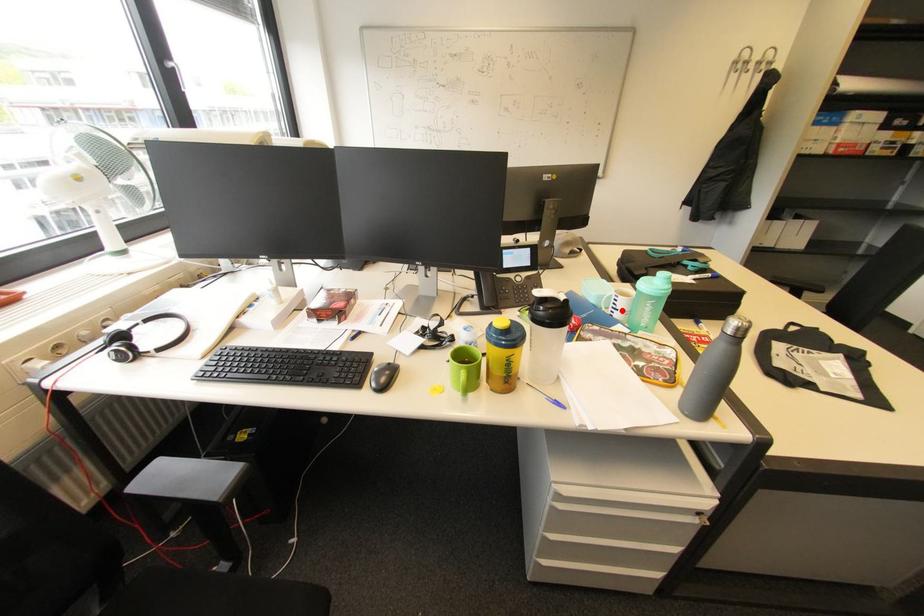
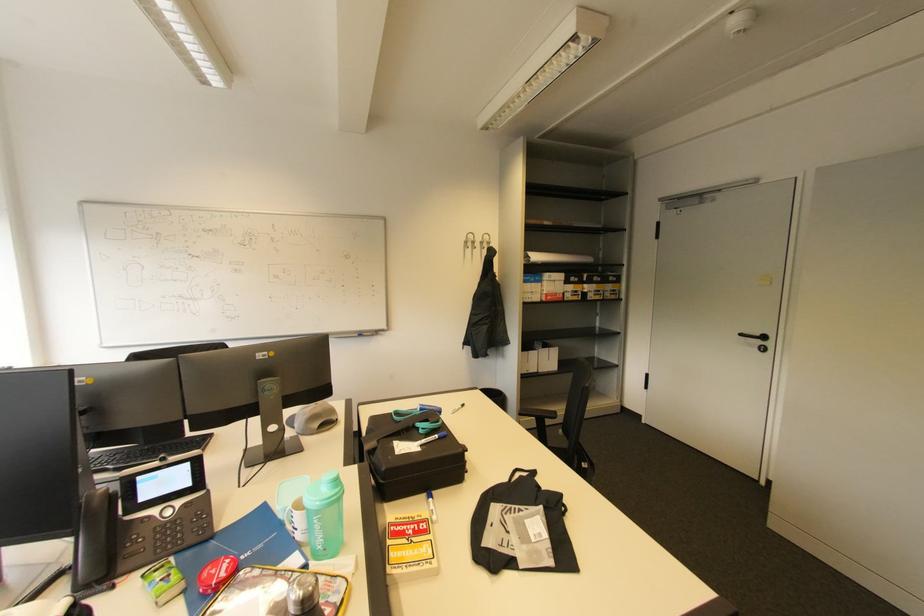
Question: A red point is marked in image1. In image2, is the corresponding 3D point closer to the camera or farther? Reply with the corresponding letter.

Choices:
 (A) The corresponding 3D point is closer.
 (B) The corresponding 3D point is farther.

Answer: (B)